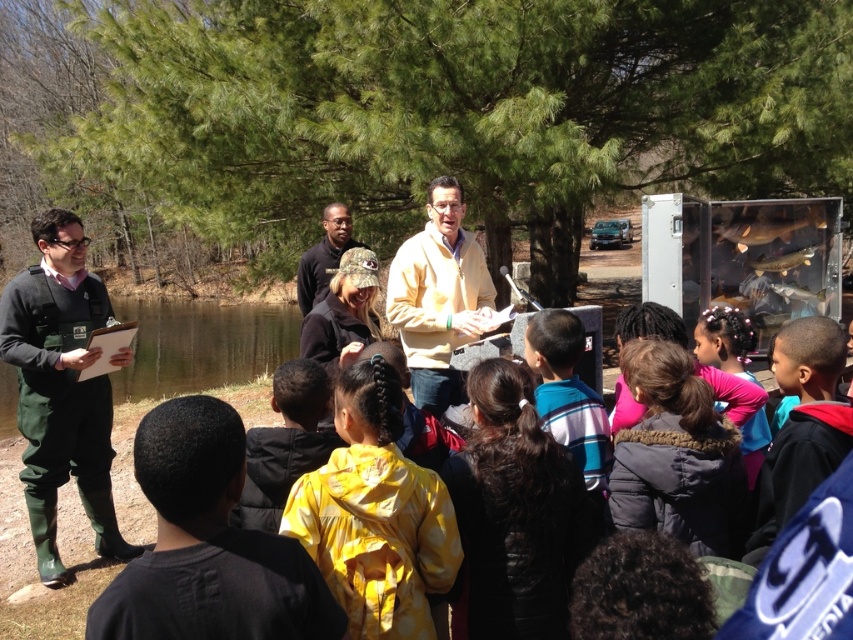
Between yellow matte jacket at center and striped cotton shirt at center, which one is positioned lower?

striped cotton shirt at center is lower down.

Is yellow matte jacket at center taller than striped cotton shirt at center?

Yes, yellow matte jacket at center is taller than striped cotton shirt at center.

Is point (427, 211) positioned behind point (543, 401)?

Yes, it is.

Locate an element on the screen. yellow matte jacket at center is located at coordinates (439, 296).

Can you confirm if striped cotton shirt at center is positioned below camouflage fabric cap at center?

Yes, striped cotton shirt at center is below camouflage fabric cap at center.

How far apart are striped cotton shirt at center and camouflage fabric cap at center?

striped cotton shirt at center is 10.64 feet from camouflage fabric cap at center.

Find the location of `striped cotton shirt at center`. striped cotton shirt at center is located at coordinates (x=567, y=394).

Is point (39, 545) farther from viewer compared to point (643, 392)?

Yes, it is.

Where is `green uniform at left`? This screenshot has height=640, width=853. green uniform at left is located at coordinates (61, 388).

This screenshot has width=853, height=640. What do you see at coordinates (61, 388) in the screenshot? I see `green uniform at left` at bounding box center [61, 388].

The image size is (853, 640). What are the coordinates of `green uniform at left` in the screenshot? It's located at (61, 388).